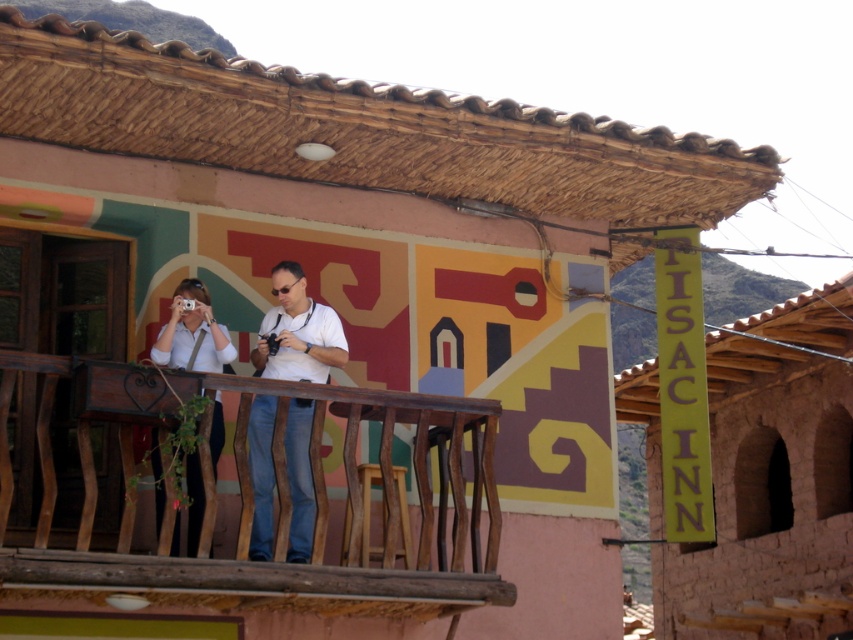
You are standing on the balcony of TISAC INN and want to place a small potted plant between the brown wooden balcony at center and the white matte shirt at center. Based on their positions, which object should the plant be closer to?

The brown wooden balcony at center is positioned on the right side of white matte shirt at center, so the plant should be placed closer to the white matte shirt at center to be between them.

You are planning to place a small potted plant on the brown wooden balcony at center. The plant requires a space that is wider than the white matte shirt at center. Will the balcony provide enough width for the plant?

The brown wooden balcony at center has a width less than the white matte shirt at center, so it cannot accommodate the plant requiring more width than the shirt.